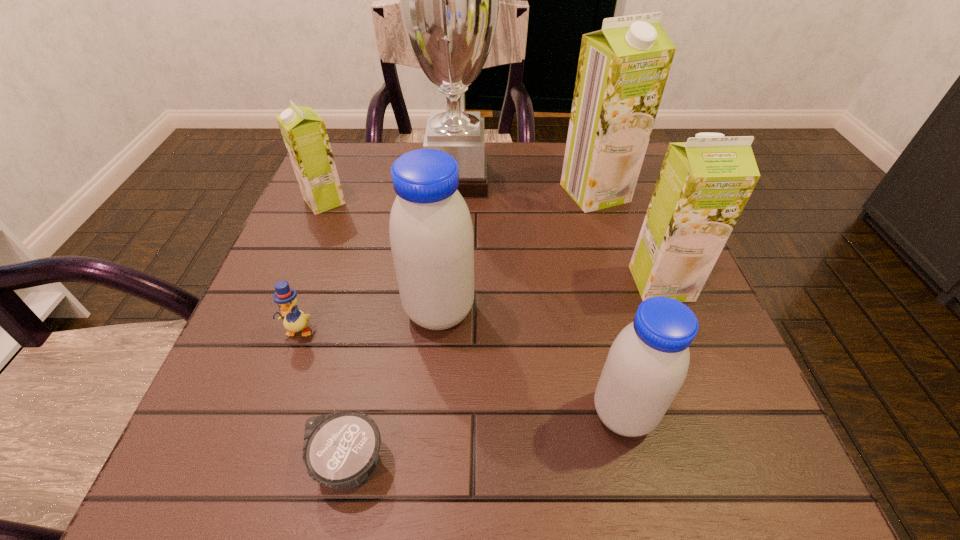
The height and width of the screenshot is (540, 960). I want to click on trophy cup, so click(x=449, y=0).

The image size is (960, 540). What are the coordinates of `the tallest soya milk` in the screenshot? It's located at (622, 71).

Where is `the seventh shortest object`? the seventh shortest object is located at coordinates (622, 71).

Where is `the second smallest green soya milk`? This screenshot has width=960, height=540. the second smallest green soya milk is located at coordinates (704, 184).

Where is `the farther blue soya milk`? The image size is (960, 540). the farther blue soya milk is located at coordinates (431, 235).

Locate an element on the screen. Image resolution: width=960 pixels, height=540 pixels. the bigger blue soya milk is located at coordinates (431, 235).

The image size is (960, 540). I want to click on the leftmost green soya milk, so click(x=303, y=130).

The width and height of the screenshot is (960, 540). Find the location of `the smallest green soya milk`. the smallest green soya milk is located at coordinates (303, 130).

Identify the location of the nearest soya milk. (647, 364).

Identify the location of the nearer blue soya milk. (647, 364).